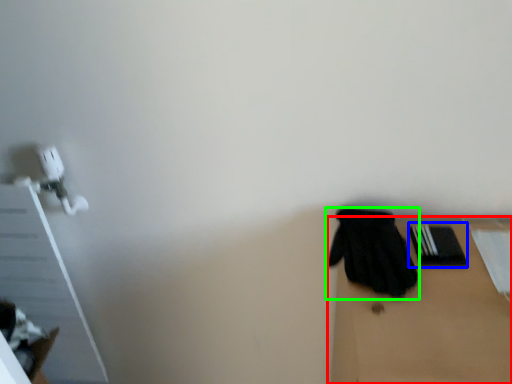
Question: Estimate the real-world distances between objects in this image. Which object is farther from table (highlighted by a red box), bin (highlighted by a blue box) or glove (highlighted by a green box)?

Choices:
 (A) bin
 (B) glove

Answer: (A)